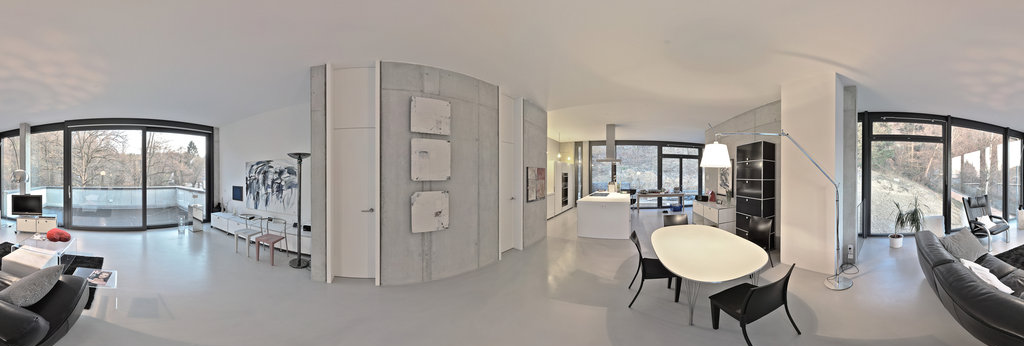
Identify the location of lamp base. (842, 284).